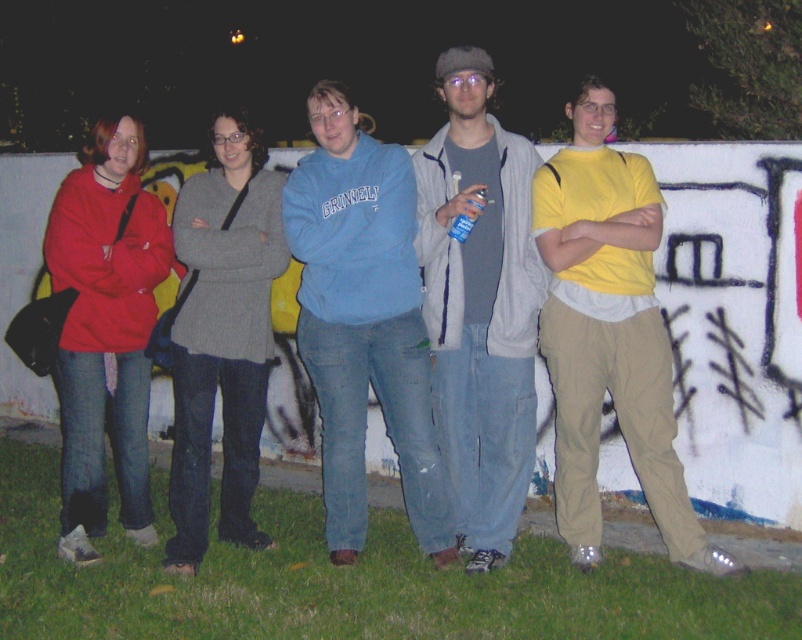
In the scene shown: You are trying to take a photo of the matte gray jacket at center and the blue sweatshirt at center. Which one is closer to the camera?

The blue sweatshirt at center is closer to the camera because the matte gray jacket at center is behind it.

You are trying to identify the person in the yellow cotton shirt at center and the blue sweatshirt at center. According to the scene description, which one is standing to the right of the other?

The yellow cotton shirt at center is positioned on the right side of blue sweatshirt at center.

You are a photographer trying to adjust the lighting for the group photo. The yellow cotton shirt at center and the matte gray jacket at center are both in the center of the image. Which clothing item is closer to the camera?

The yellow cotton shirt at center is shorter than the matte gray jacket at center, so the yellow cotton shirt at center is closer to the camera.